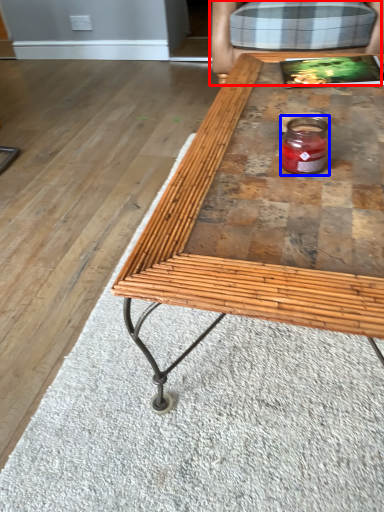
Question: Which point is further to the camera, armchair (highlighted by a red box) or glass jar (highlighted by a blue box)?

Choices:
 (A) armchair
 (B) glass jar

Answer: (A)